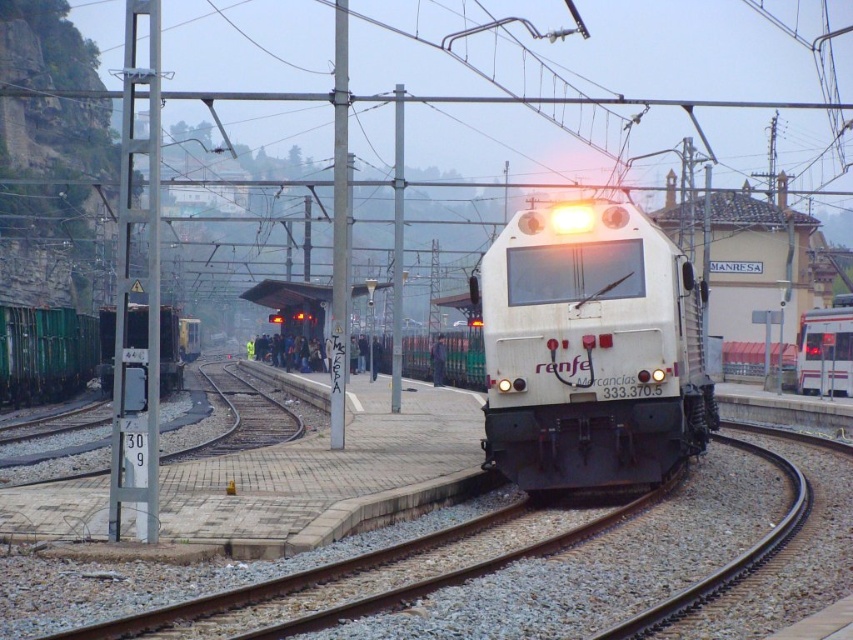
You are a train engineer who needs to attach the green matte freight car at left to the white matte locomotive at center. Based on the scene description, which one should be placed in front to ensure proper coupling?

The white matte locomotive at center should be placed in front since it is smaller than the green matte freight car at left, and locomotives typically lead the train.

You are standing at the point marked as point (590, 348) in the railway station image. What object is located exactly at your current position?

The white matte locomotive at center is located exactly at point (590, 348).